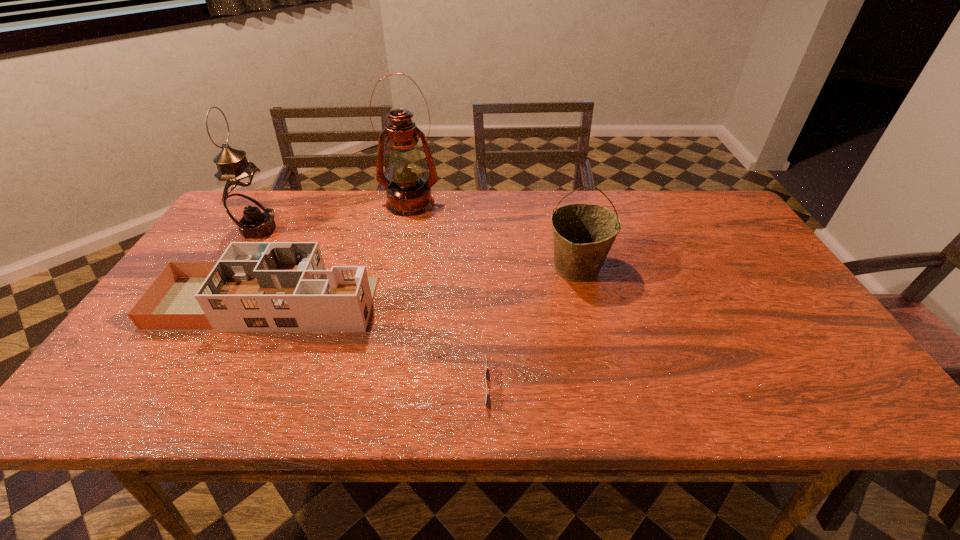
Locate an element on the screen. Image resolution: width=960 pixels, height=540 pixels. the farthest object is located at coordinates (408, 194).

Locate an element on the screen. This screenshot has height=540, width=960. the right oil lamp is located at coordinates (408, 194).

Identify the location of the second farthest object. (244, 197).

You are a GUI agent. You are given a task and a screenshot of the screen. Output one action in this format:
    pyautogui.click(x=<x>, y=<y>)
    Task: Click on the left oil lamp
    This screenshot has height=540, width=960.
    Given the screenshot: What is the action you would take?
    pyautogui.click(x=244, y=197)

Locate an element on the screen. the third tallest object is located at coordinates (583, 234).

Image resolution: width=960 pixels, height=540 pixels. In order to click on wine bucket in this screenshot , I will do `click(583, 234)`.

Find the location of a particular element. dollhouse is located at coordinates (255, 286).

Identify the location of sunglasses. (485, 403).

You are a GUI agent. You are given a task and a screenshot of the screen. Output one action in this format:
    pyautogui.click(x=<x>, y=<y>)
    Task: Click on the fourth object from left to right
    Image resolution: width=960 pixels, height=540 pixels.
    Given the screenshot: What is the action you would take?
    pyautogui.click(x=485, y=403)

Locate an element on the screen. Image resolution: width=960 pixels, height=540 pixels. vacant area located on the front of the farther oil lamp is located at coordinates (388, 308).